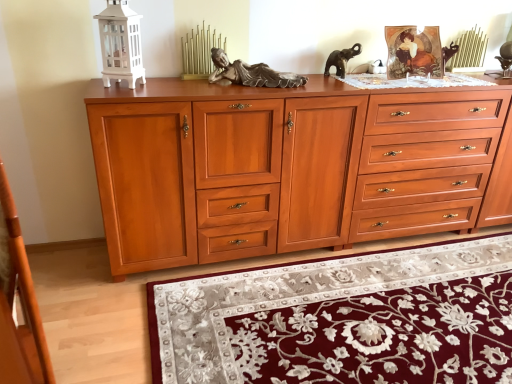
Question: Considering the relative sizes of wooden drawer at center, which ranks as the first drawer in left-to-right order, and cherry wood drawers at right, which is the 1th drawer from right to left, in the image provided, is wooden drawer at center, which ranks as the first drawer in left-to-right order, thinner than cherry wood drawers at right, which is the 1th drawer from right to left,?

Choices:
 (A) yes
 (B) no

Answer: (A)

Question: Does wooden drawer at center, which is the 2th drawer from right to left, turn towards cherry wood drawers at right, acting as the 2th drawer starting from the left?

Choices:
 (A) yes
 (B) no

Answer: (A)

Question: Does wooden drawer at center, which is the 2th drawer from right to left, lie in front of cherry wood drawers at right, acting as the 2th drawer starting from the left?

Choices:
 (A) no
 (B) yes

Answer: (B)

Question: Would you say wooden drawer at center, which is the 2th drawer from right to left, is outside cherry wood drawers at right, which is the 1th drawer from right to left?

Choices:
 (A) yes
 (B) no

Answer: (A)

Question: Is wooden drawer at center, which ranks as the first drawer in left-to-right order, next to cherry wood drawers at right, which is the 1th drawer from right to left?

Choices:
 (A) yes
 (B) no

Answer: (B)

Question: Does wooden drawer at center, which ranks as the first drawer in left-to-right order, contain cherry wood drawers at right, which is the 1th drawer from right to left?

Choices:
 (A) no
 (B) yes

Answer: (A)

Question: Considering the relative positions of cherry wood chest of drawers at center and wooden drawer at center, which ranks as the first drawer in left-to-right order, in the image provided, is cherry wood chest of drawers at center to the right of wooden drawer at center, which ranks as the first drawer in left-to-right order, from the viewer's perspective?

Choices:
 (A) yes
 (B) no

Answer: (A)

Question: Can we say cherry wood chest of drawers at center lies outside wooden drawer at center, which ranks as the first drawer in left-to-right order?

Choices:
 (A) no
 (B) yes

Answer: (B)

Question: Can you confirm if cherry wood chest of drawers at center is wider than wooden drawer at center, which is the 2th drawer from right to left?

Choices:
 (A) yes
 (B) no

Answer: (A)

Question: Is wooden drawer at center, which is the 2th drawer from right to left, surrounded by cherry wood chest of drawers at center?

Choices:
 (A) yes
 (B) no

Answer: (A)

Question: Is the surface of cherry wood chest of drawers at center in direct contact with wooden drawer at center, which is the 2th drawer from right to left?

Choices:
 (A) yes
 (B) no

Answer: (B)

Question: From a real-world perspective, does cherry wood chest of drawers at center sit lower than wooden drawer at center, which is the 2th drawer from right to left?

Choices:
 (A) yes
 (B) no

Answer: (A)

Question: Could you tell me if wooden drawer at center, which is the 2th drawer from right to left, is facing velvet burgundy rug at lower center?

Choices:
 (A) no
 (B) yes

Answer: (B)